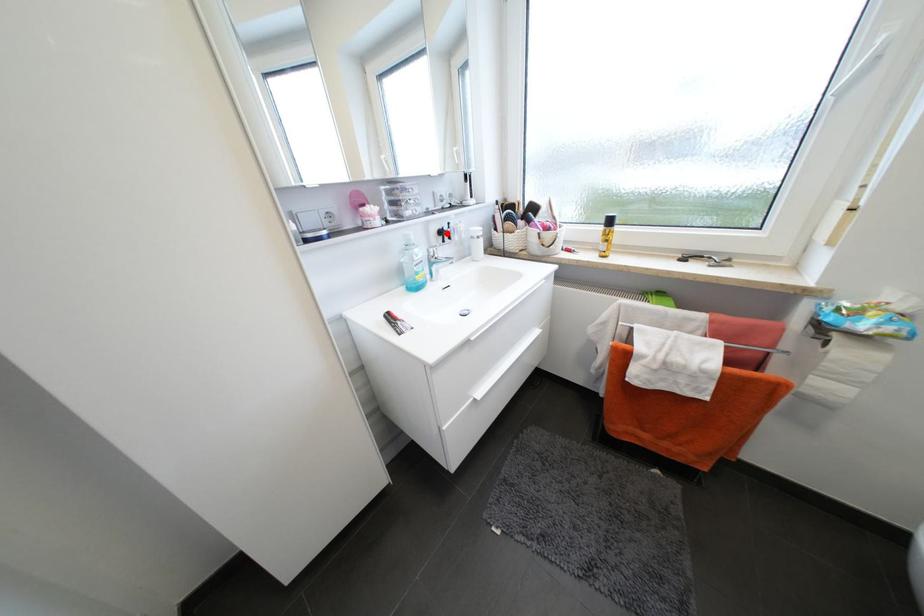
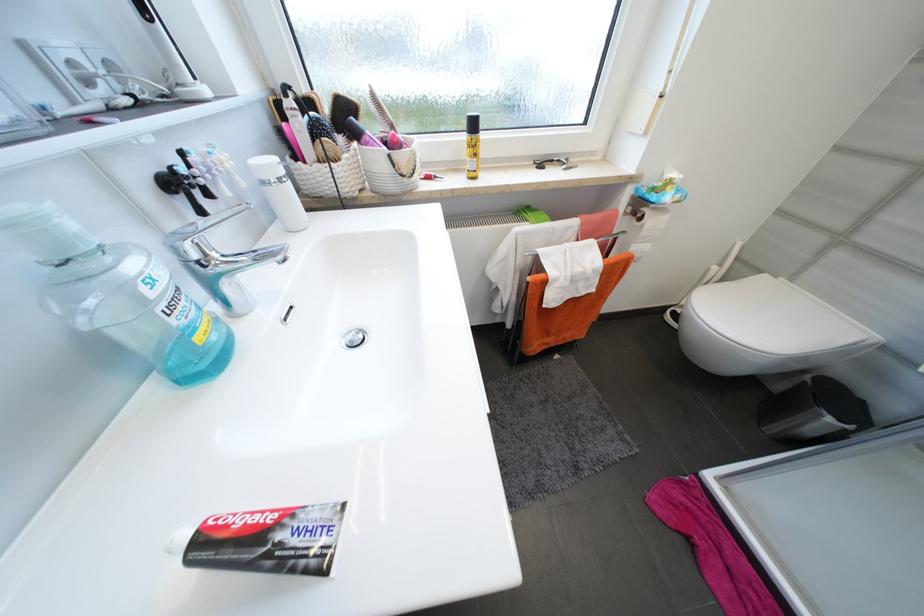
Locate, in the second image, the point that corresponds to the highlighted location in the first image.

(178, 185)